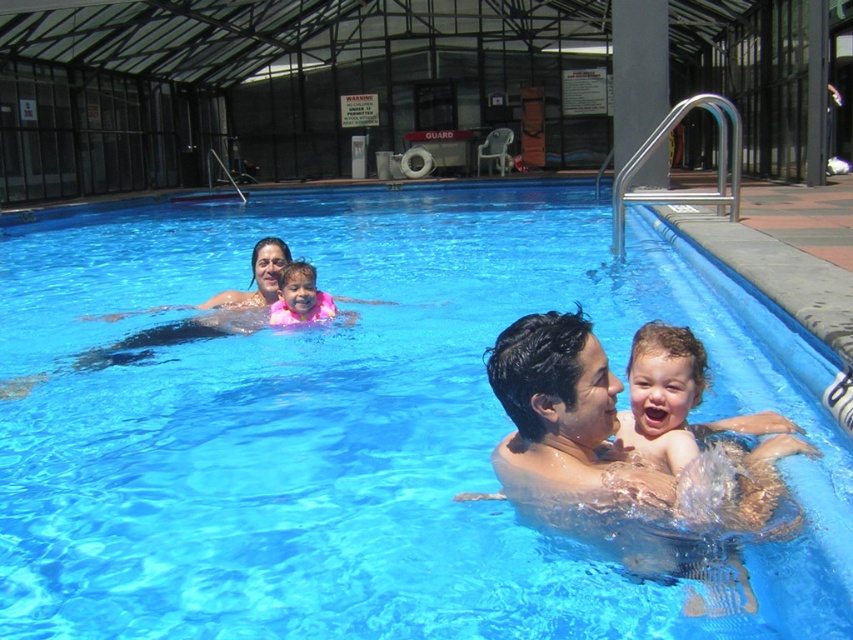
You are a photographer standing at the edge of the pool. You want to take a photo of the light brown skin at center and the pink fabric at center. Based on their positions, which one is closer to you?

The light brown skin at center is closer to you because it is in front of the pink fabric at center.